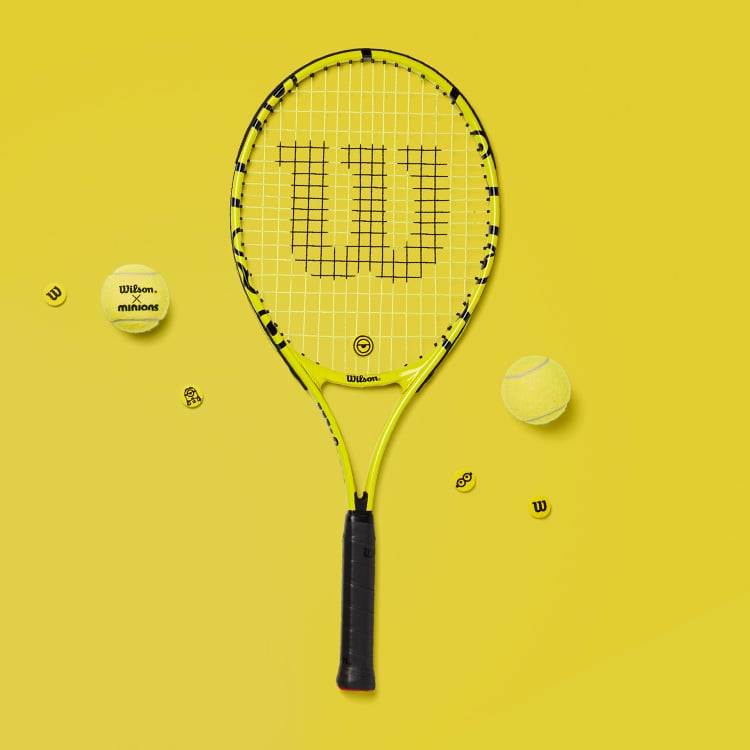
The height and width of the screenshot is (750, 750). I want to click on handle, so click(x=352, y=621).